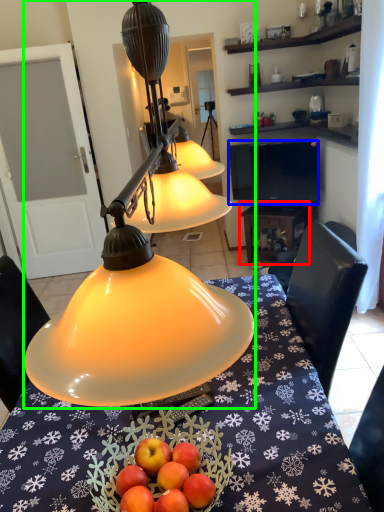
Question: Considering the real-world distances, which object is farthest from table (highlighted by a red box)? television (highlighted by a blue box) or lamp (highlighted by a green box)?

Choices:
 (A) television
 (B) lamp

Answer: (B)